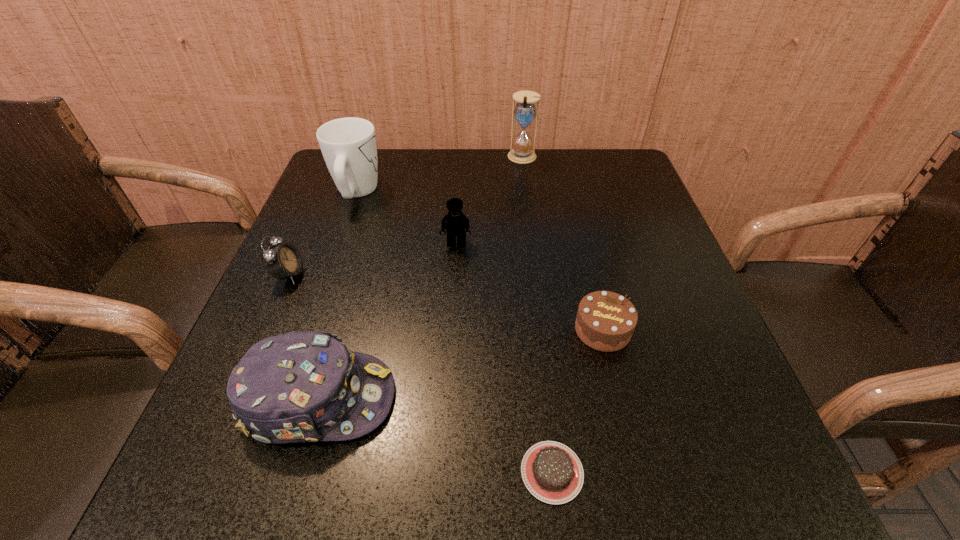
Locate an element on the screen. object at the near left corner is located at coordinates (297, 387).

In the image, there is a desktop. Identify the location of free region at the far edge. (387, 166).

Image resolution: width=960 pixels, height=540 pixels. I want to click on blank space at the near edge of the desktop, so click(361, 474).

The height and width of the screenshot is (540, 960). In order to click on vacant space at the left edge of the desktop in this screenshot , I will do `click(208, 416)`.

Where is `free space at the far right corner of the desktop`? The height and width of the screenshot is (540, 960). free space at the far right corner of the desktop is located at coordinates (603, 197).

In order to click on vacant area between the farther chocolate cake and the hourglass in this screenshot , I will do `click(563, 244)`.

At what (x,y) coordinates should I click in order to perform the action: click on free space between the fifth tallest object and the sixth nearest object. Please return your answer as a coordinate pair (x, y). Looking at the image, I should click on (323, 234).

Where is `vacant area between the left chocolate cake and the hourglass`? vacant area between the left chocolate cake and the hourglass is located at coordinates (538, 315).

At what (x,y) coordinates should I click in order to perform the action: click on free space between the fourth object from left to right and the shorter chocolate cake. Please return your answer as a coordinate pair (x, y). Image resolution: width=960 pixels, height=540 pixels. Looking at the image, I should click on (504, 357).

Image resolution: width=960 pixels, height=540 pixels. Identify the location of vacant area that lies between the right chocolate cake and the shorter chocolate cake. (577, 401).